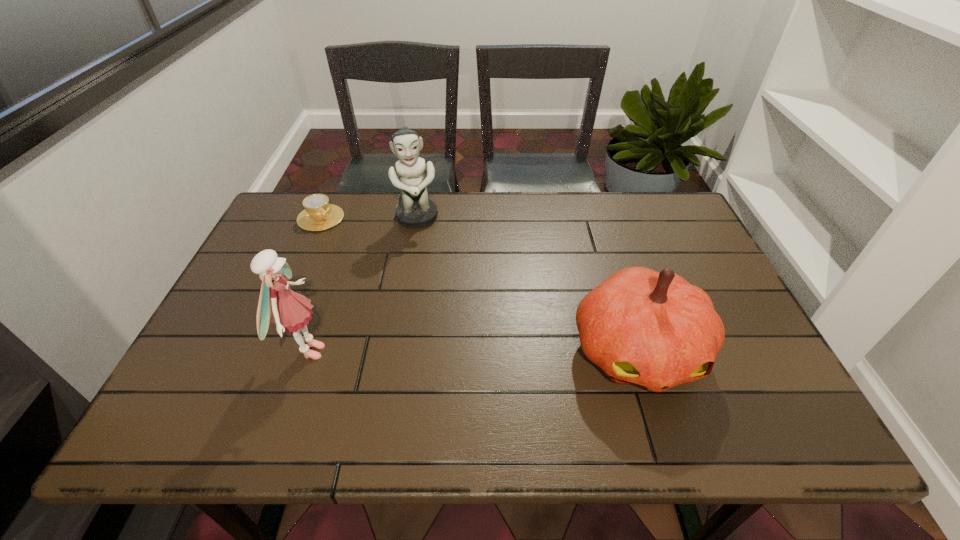
Where is `vacant point located between the doll and the cup`? The height and width of the screenshot is (540, 960). vacant point located between the doll and the cup is located at coordinates (314, 285).

The height and width of the screenshot is (540, 960). Find the location of `free spot between the doll and the third tallest object`. free spot between the doll and the third tallest object is located at coordinates (472, 352).

Find the location of a particular element. The image size is (960, 540). vacant area that lies between the figurine and the third tallest object is located at coordinates (527, 285).

Identify the location of empty space that is in between the doll and the pumpkin. (472, 352).

In order to click on vacant area that lies between the doll and the third object from left to right in this screenshot , I will do `click(363, 285)`.

Locate which object ranks third in proximity to the figurine. Please provide its 2D coordinates. Your answer should be formatted as a tuple, i.e. [(x, y)], where the tuple contains the x and y coordinates of a point satisfying the conditions above.

[(653, 329)]

Locate which object is the third closest to the rightmost object. Please provide its 2D coordinates. Your answer should be formatted as a tuple, i.e. [(x, y)], where the tuple contains the x and y coordinates of a point satisfying the conditions above.

[(318, 215)]